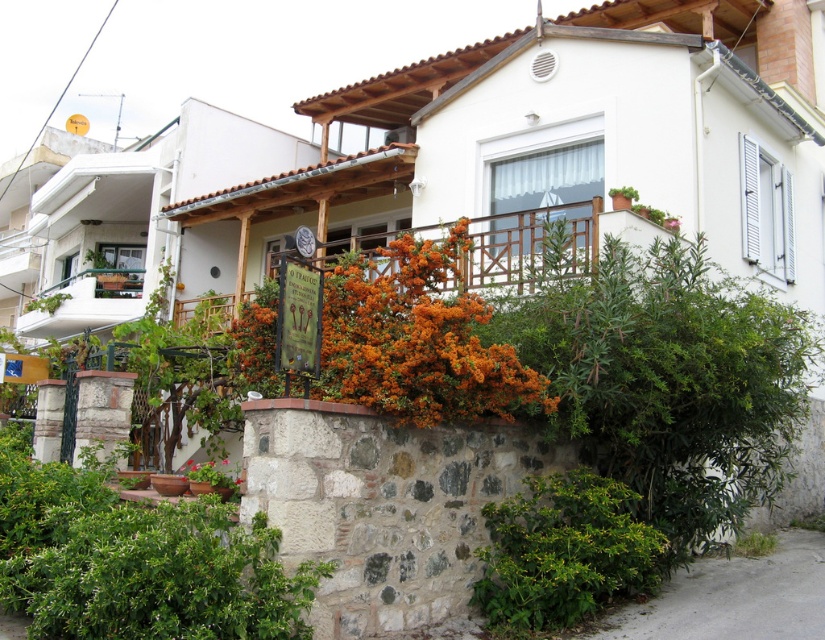
Question: Which point appears farthest from the camera in this image?

Choices:
 (A) (573, 589)
 (B) (742, 554)
 (C) (214, 468)
 (D) (456, 308)

Answer: (C)

Question: Is green leafy plant at lower center wider than green leafy plant at lower right?

Choices:
 (A) yes
 (B) no

Answer: (B)

Question: Is orange matte flowers at center above white painted wood at left?

Choices:
 (A) no
 (B) yes

Answer: (A)

Question: Which is farther from the green leafy bush at lower center?

Choices:
 (A) white painted wood at left
 (B) orange matte flowers at center
 (C) green leafy plant at lower center

Answer: (A)

Question: Which object appears closest to the camera in this image?

Choices:
 (A) green leafy plant at lower right
 (B) orange matte flowers at center
 (C) white painted wood at left
 (D) green leafy plant at lower center

Answer: (B)

Question: From the image, what is the correct spatial relationship of orange matte flowers at center in relation to green leafy plant at lower center?

Choices:
 (A) above
 (B) below

Answer: (A)